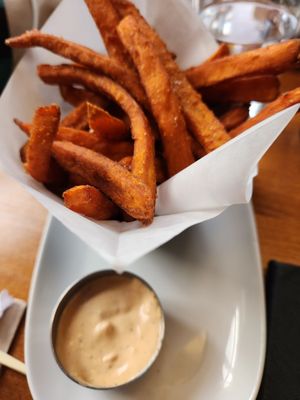
Locate an element on the screen. Image resolution: width=300 pixels, height=400 pixels. table is located at coordinates coord(276,243).